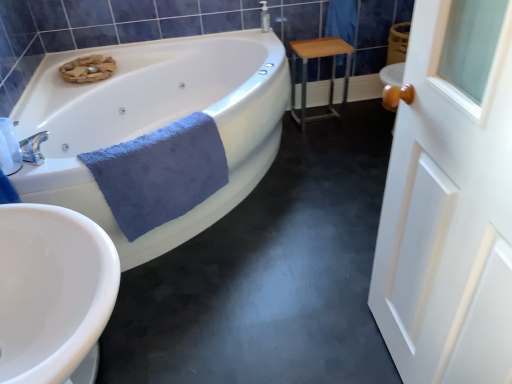
Question: Is white glossy bathtub at upper left to the left of white wooden door at right from the viewer's perspective?

Choices:
 (A) no
 (B) yes

Answer: (B)

Question: Is white glossy bathtub at upper left shorter than white wooden door at right?

Choices:
 (A) no
 (B) yes

Answer: (B)

Question: Is white wooden door at right completely or partially inside white glossy bathtub at upper left?

Choices:
 (A) yes
 (B) no

Answer: (B)

Question: Is white glossy bathtub at upper left positioned beyond the bounds of white wooden door at right?

Choices:
 (A) no
 (B) yes

Answer: (B)

Question: From a real-world perspective, is white glossy bathtub at upper left positioned under white wooden door at right based on gravity?

Choices:
 (A) no
 (B) yes

Answer: (B)

Question: In terms of height, does white glossy electric kettle at left look taller or shorter compared to white wooden door at right?

Choices:
 (A) tall
 (B) short

Answer: (B)

Question: Is white glossy electric kettle at left spatially inside white wooden door at right, or outside of it?

Choices:
 (A) inside
 (B) outside

Answer: (B)

Question: From the image's perspective, is white glossy electric kettle at left located above or below white wooden door at right?

Choices:
 (A) above
 (B) below

Answer: (A)

Question: In the image, is white glossy electric kettle at left positioned in front of or behind white wooden door at right?

Choices:
 (A) behind
 (B) front

Answer: (A)

Question: Is white wooden door at right situated inside light brown wood table at center right or outside?

Choices:
 (A) outside
 (B) inside

Answer: (A)

Question: Is point (434, 172) positioned closer to the camera than point (303, 56)?

Choices:
 (A) farther
 (B) closer

Answer: (B)

Question: Visually, is white wooden door at right positioned to the left or to the right of light brown wood table at center right?

Choices:
 (A) left
 (B) right

Answer: (B)

Question: From a real-world perspective, relative to light brown wood table at center right, is white wooden door at right vertically above or below?

Choices:
 (A) above
 (B) below

Answer: (A)

Question: In terms of width, does white wooden door at right look wider or thinner when compared to blue soft towel at lower left?

Choices:
 (A) wide
 (B) thin

Answer: (B)

Question: From the image's perspective, relative to blue soft towel at lower left, is white wooden door at right above or below?

Choices:
 (A) above
 (B) below

Answer: (B)